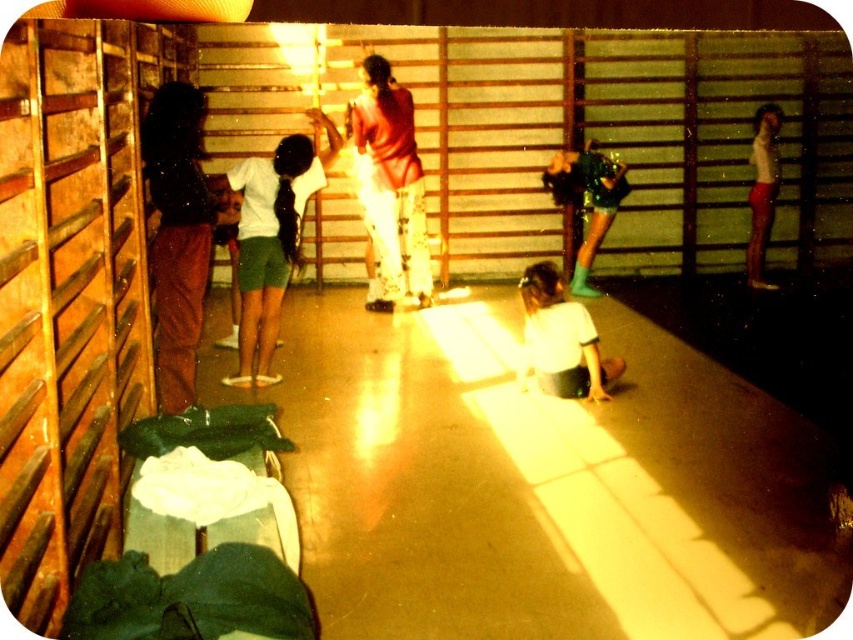
Is point (167, 323) more distant than point (245, 278)?

No, it is not.

Is matte brown pants at left bigger than white matte shorts at center?

Incorrect, matte brown pants at left is not larger than white matte shorts at center.

Between point (177, 216) and point (305, 196), which one is positioned behind?

Positioned behind is point (305, 196).

The height and width of the screenshot is (640, 853). I want to click on matte brown pants at left, so click(177, 236).

Does point (294, 177) come closer to viewer compared to point (553, 166)?

Yes, it is.

Describe the element at coordinates (271, 240) in the screenshot. I see `white matte shorts at center` at that location.

The height and width of the screenshot is (640, 853). Identify the location of white matte shorts at center. (271, 240).

Is white matte shorts at center to the left of white matte shirt at lower center from the viewer's perspective?

Indeed, white matte shorts at center is positioned on the left side of white matte shirt at lower center.

Does point (247, 216) come behind point (538, 381)?

Yes, it is behind point (538, 381).

Does point (334, 148) come behind point (608, 371)?

Yes, point (334, 148) is behind point (608, 371).

Image resolution: width=853 pixels, height=640 pixels. In order to click on white matte shorts at center in this screenshot , I will do `click(271, 240)`.